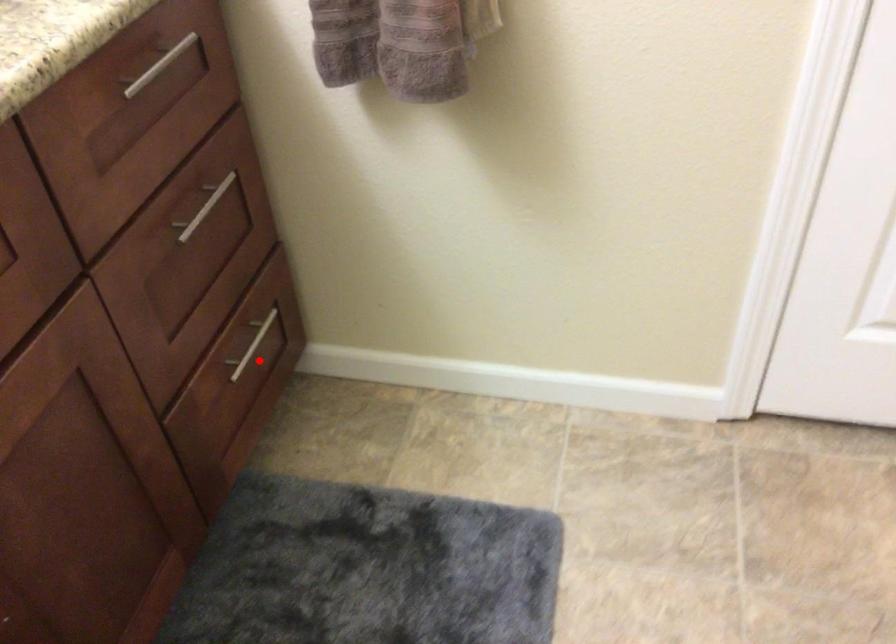
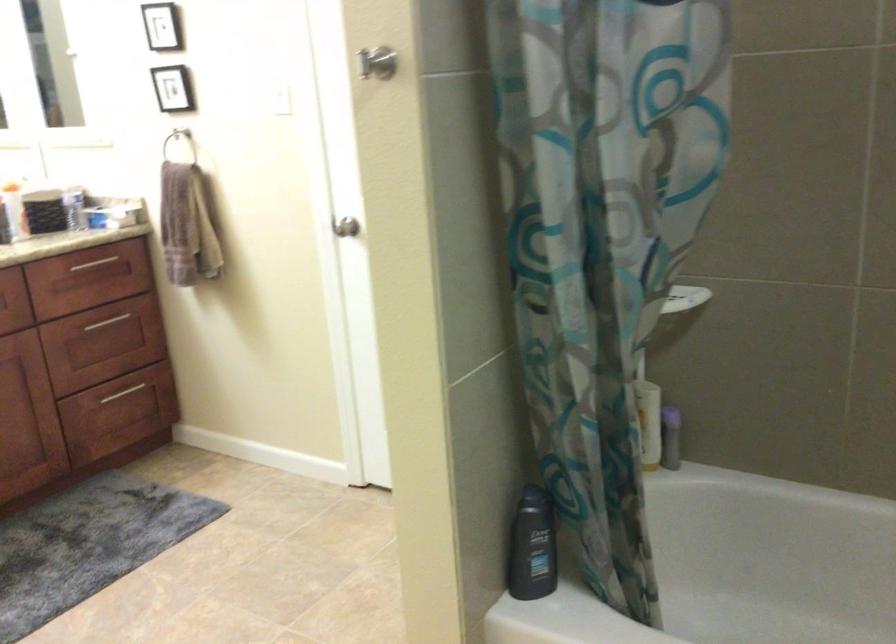
The point at the highlighted location is marked in the first image. Where is the corresponding point in the second image?

(122, 393)